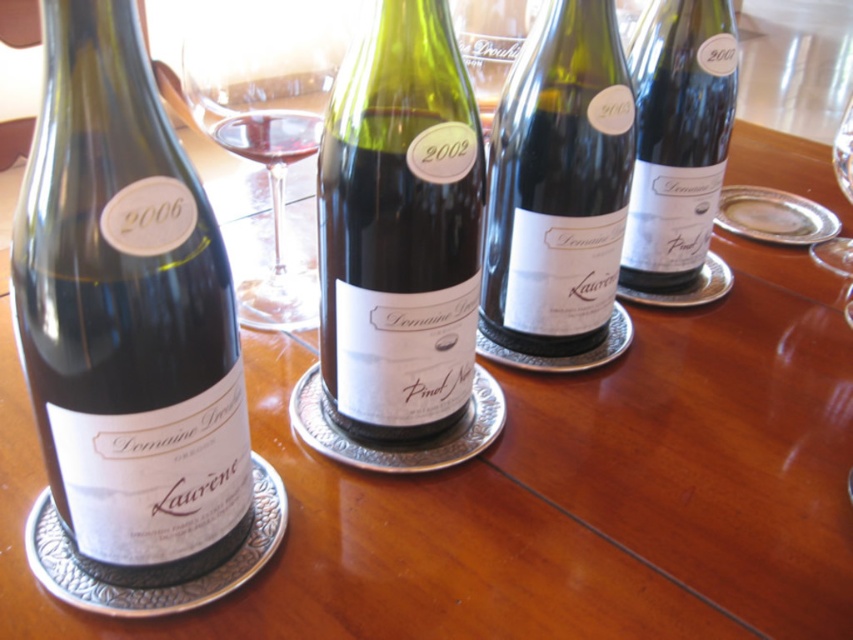
Does matte glass wine bottle at left appear on the right side of green glass bottle at center?

No, matte glass wine bottle at left is not to the right of green glass bottle at center.

Does matte glass wine bottle at left come behind green glass bottle at center?

No.

Identify the location of matte glass wine bottle at left. The image size is (853, 640). (126, 316).

Is green glass bottle at center to the right of matte white wine at center from the viewer's perspective?

Incorrect, green glass bottle at center is not on the right side of matte white wine at center.

Is point (320, 268) less distant than point (576, 163)?

Yes, point (320, 268) is in front of point (576, 163).

What do you see at coordinates (399, 227) in the screenshot? The image size is (853, 640). I see `green glass bottle at center` at bounding box center [399, 227].

Where is `green glass bottle at center`? green glass bottle at center is located at coordinates (399, 227).

Which is in front, point (396, 83) or point (735, 70)?

Positioned in front is point (396, 83).

Is point (398, 348) closer to viewer compared to point (706, 29)?

Yes, point (398, 348) is closer to viewer.

Locate an element on the screen. This screenshot has height=640, width=853. green glass bottle at center is located at coordinates (399, 227).